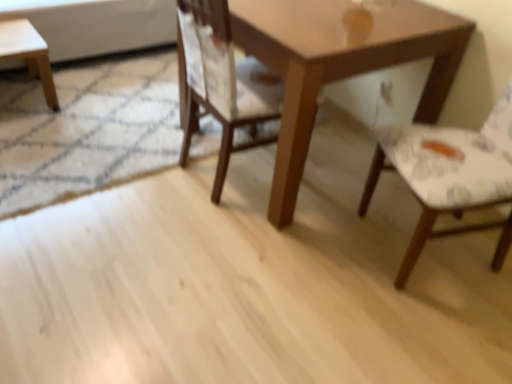
Where is `space that is in front of white fabric chair at right, which appears as the first chair when viewed from the right`? The height and width of the screenshot is (384, 512). space that is in front of white fabric chair at right, which appears as the first chair when viewed from the right is located at coordinates (428, 324).